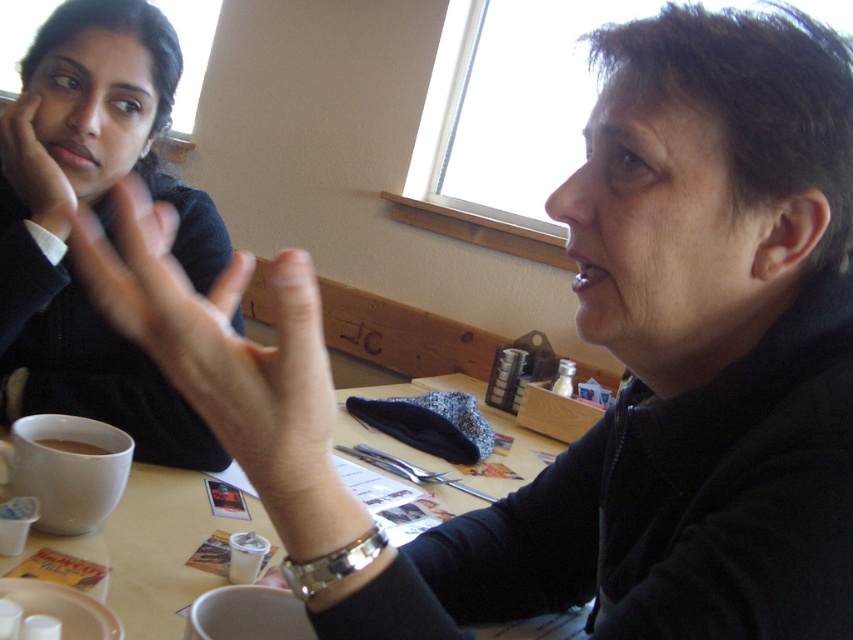
Is matte black sweater at upper left below white matte mug at lower left?

Actually, matte black sweater at upper left is above white matte mug at lower left.

Does matte black sweater at upper left have a smaller size compared to white matte mug at lower left?

Incorrect, matte black sweater at upper left is not smaller in size than white matte mug at lower left.

Is point (103, 13) less distant than point (86, 493)?

No, (103, 13) is behind (86, 493).

This screenshot has width=853, height=640. What are the coordinates of `matte black sweater at upper left` in the screenshot? It's located at (100, 224).

Does skinny white hand at center appear over matte plastic table at center?

Yes, skinny white hand at center is above matte plastic table at center.

This screenshot has width=853, height=640. What do you see at coordinates (219, 342) in the screenshot?
I see `skinny white hand at center` at bounding box center [219, 342].

Locate an element on the screen. This screenshot has height=640, width=853. skinny white hand at center is located at coordinates (219, 342).

Is point (138, 384) positioned behind point (62, 228)?

Yes.

Find the location of a particular element. The image size is (853, 640). matte black sweater at upper left is located at coordinates (100, 224).